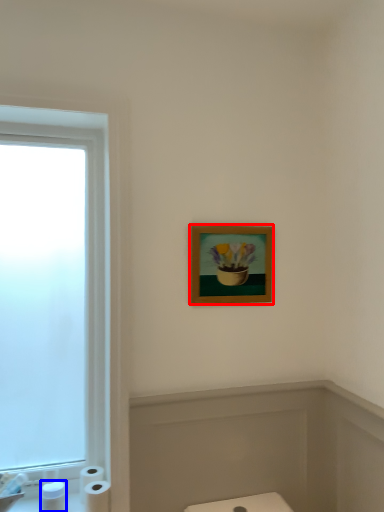
Question: Which point is closer to the camera, picture frame (highlighted by a red box) or toiletry (highlighted by a blue box)?

Choices:
 (A) picture frame
 (B) toiletry

Answer: (B)